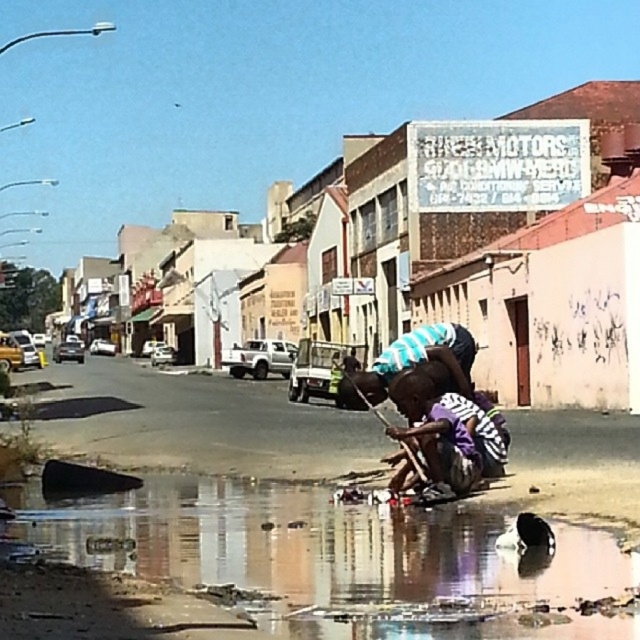
You are standing on the street and want to avoid stepping into the reflective wet sand at lower center. Based on its coordinates, which direction should you move to stay dry?

The reflective wet sand at lower center is located at point (316, 545). To avoid it, move away from the lower center area towards higher coordinates on the image.

You are standing at the point with coordinates point (x=636, y=634) and want to walk towards the point (x=448, y=456). Which direction should you face to move directly towards it?

You should face north because point (x=636, y=634) is in front of point (x=448, y=456), meaning it is closer to you. To reach point (x=448, y=456), you need to move away from your current position towards the north direction.

You are standing at the point labeled as point [316,545] in the image. What surface are you currently standing on?

You are standing on reflective wet sand at lower center.